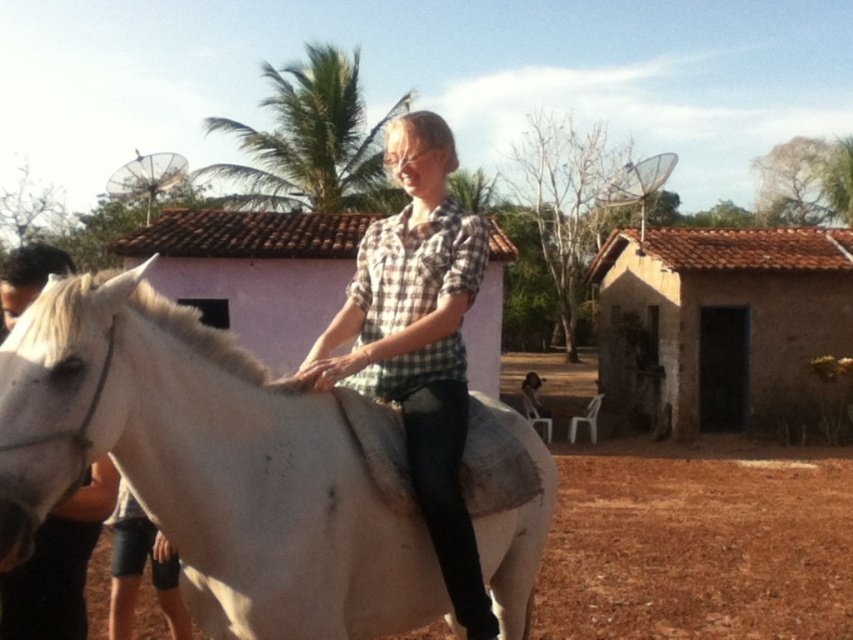
Question: Which object is positioned closest to the brown mud hut at center?

Choices:
 (A) brown dirt field at lower center
 (B) pink stucco hut at center
 (C) white matte horse at left
 (D) checkered fabric shirt at center

Answer: (A)

Question: Is checkered fabric shirt at center below pink stucco hut at center?

Choices:
 (A) yes
 (B) no

Answer: (A)

Question: Is white matte horse at center to the right of brown mud hut at center from the viewer's perspective?

Choices:
 (A) no
 (B) yes

Answer: (A)

Question: Which point is closer to the camera?

Choices:
 (A) brown mud hut at center
 (B) pink stucco hut at center

Answer: (B)

Question: Which of the following is the closest to the observer?

Choices:
 (A) pink stucco hut at center
 (B) checkered fabric shirt at center

Answer: (B)

Question: Can you confirm if white matte horse at center is positioned to the left of checkered fabric shirt at center?

Choices:
 (A) no
 (B) yes

Answer: (B)